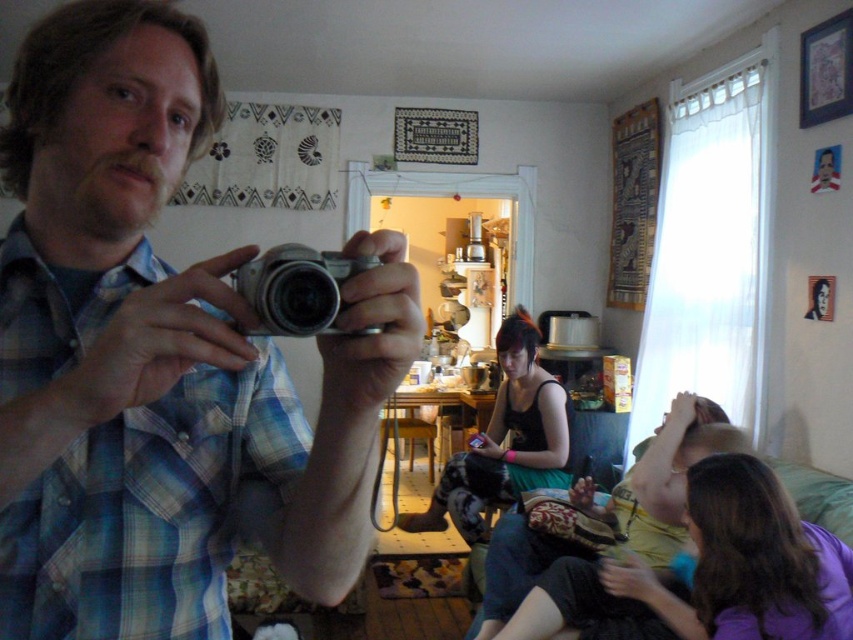
Does matte silver camera at center have a greater width compared to purple matte shirt at lower right?

No, matte silver camera at center is not wider than purple matte shirt at lower right.

Is matte silver camera at center smaller than purple matte shirt at lower right?

Yes.

Locate an element on the screen. matte silver camera at center is located at coordinates (160, 358).

Between matte green dress at center and silver metallic camera at center, which one has less height?

silver metallic camera at center

Can you confirm if matte green dress at center is positioned to the right of silver metallic camera at center?

Correct, you'll find matte green dress at center to the right of silver metallic camera at center.

This screenshot has width=853, height=640. Describe the element at coordinates (660, 477) in the screenshot. I see `matte green dress at center` at that location.

Where is `matte green dress at center`? The width and height of the screenshot is (853, 640). matte green dress at center is located at coordinates (660, 477).

Is purple matte shirt at lower right below silver metallic camera at center?

Yes.

What are the coordinates of `purple matte shirt at lower right` in the screenshot? It's located at (747, 563).

This screenshot has height=640, width=853. Describe the element at coordinates (747, 563) in the screenshot. I see `purple matte shirt at lower right` at that location.

You are a GUI agent. You are given a task and a screenshot of the screen. Output one action in this format:
    pyautogui.click(x=<x>, y=<y>)
    Task: Click on the purple matte shirt at lower right
    The image size is (853, 640).
    Given the screenshot: What is the action you would take?
    pyautogui.click(x=747, y=563)